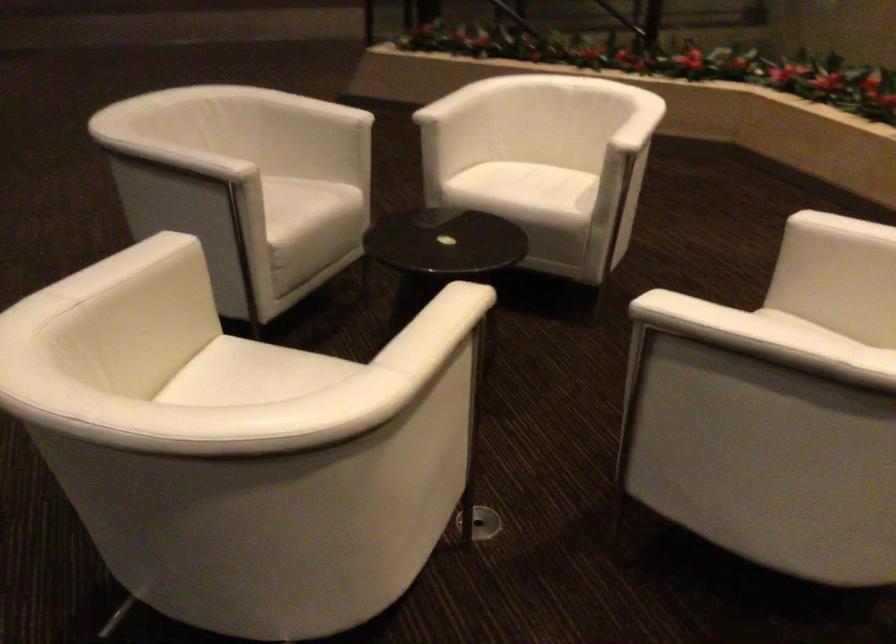
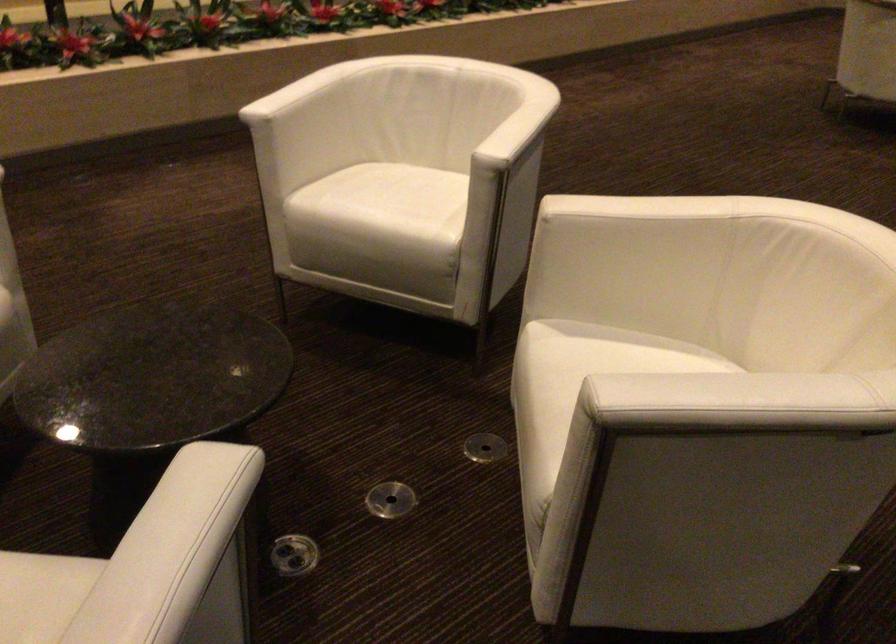
In the second image, find the point that corresponds to pixel 184 156 in the first image.

(186, 527)